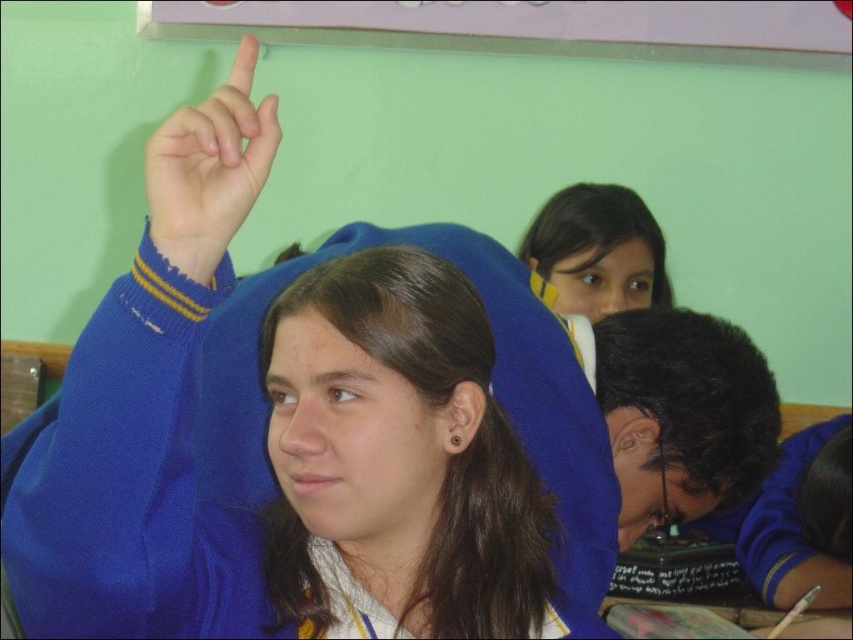
Who is higher up, matte blue uniform at center or black matte hair at lower right?

Positioned higher is black matte hair at lower right.

Does matte blue uniform at center have a greater width compared to black matte hair at lower right?

Yes.

Where is `matte blue uniform at center`? matte blue uniform at center is located at coordinates point(405,451).

Can you confirm if matte blue uniform at center is positioned to the left of matte blue hand at upper left?

In fact, matte blue uniform at center is to the right of matte blue hand at upper left.

Does matte blue uniform at center have a smaller size compared to matte blue hand at upper left?

Actually, matte blue uniform at center might be larger than matte blue hand at upper left.

Describe the element at coordinates (405, 451) in the screenshot. I see `matte blue uniform at center` at that location.

Identify the location of matte blue uniform at center. The image size is (853, 640). (405, 451).

Does blue knitted sweater at upper center lie in front of matte blue uniform at center?

Yes, blue knitted sweater at upper center is in front of matte blue uniform at center.

Find the location of a particular element. The width and height of the screenshot is (853, 640). blue knitted sweater at upper center is located at coordinates (242, 408).